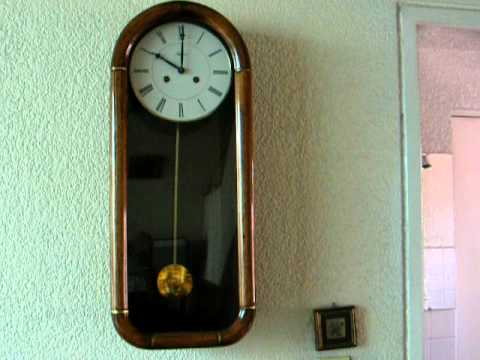
Identify the location of white clock face. This screenshot has height=360, width=480. (186, 89).